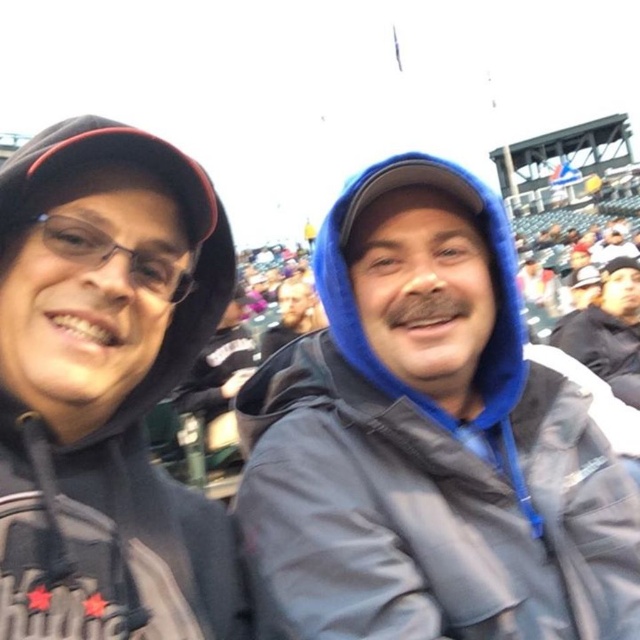
You are at a baseball game and need to find the black matte jacket at right. Based on the coordinates provided, where should you look in the image?

The black matte jacket at right is located at the 2D coordinates point (x=609, y=330) in the image.